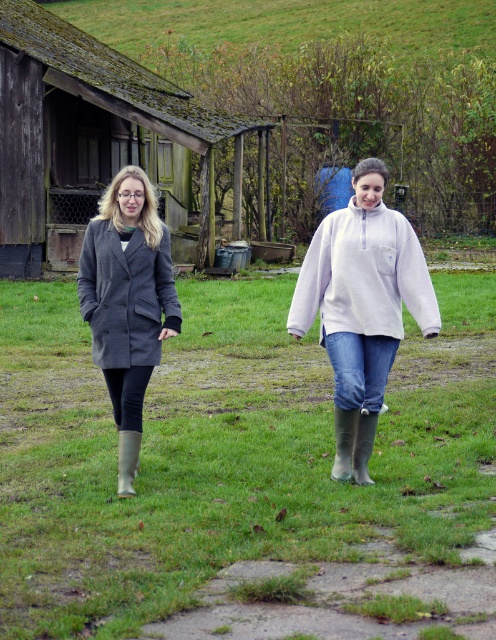
Question: Is green matte grass at center wider than wooden hut at left?

Choices:
 (A) no
 (B) yes

Answer: (B)

Question: Which of the following is the farthest from the observer?

Choices:
 (A) rubber/matte boot at lower center
 (B) fuzzy white sweatshirt at center

Answer: (A)

Question: Does wooden hut at left appear on the right side of gray woolen coat at left?

Choices:
 (A) yes
 (B) no

Answer: (B)

Question: Which of the following is the closest to the observer?

Choices:
 (A) (190, 100)
 (B) (348, 413)
 (C) (125, 440)

Answer: (C)

Question: Is fuzzy white sweater at center positioned behind fuzzy white sweatshirt at center?

Choices:
 (A) no
 (B) yes

Answer: (A)

Question: Among these points, which one is nearest to the camera?

Choices:
 (A) (168, 308)
 (B) (146, 317)
 (C) (330, 234)
 (D) (354, 440)

Answer: (B)